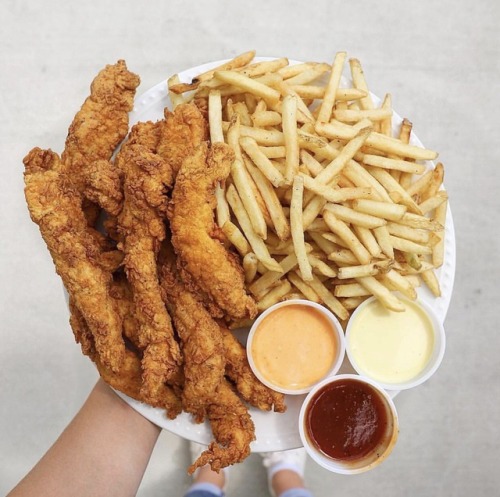
The height and width of the screenshot is (497, 500). Find the location of `white round ceramic plate`. white round ceramic plate is located at coordinates (447, 258), (176, 428), (147, 102).